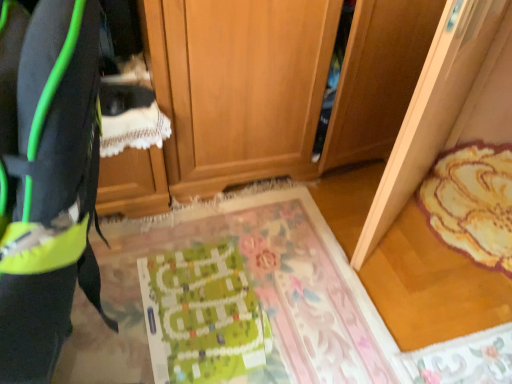
Locate an element on the screen. This screenshot has width=512, height=384. free space to the back side of green paper at center is located at coordinates (230, 235).